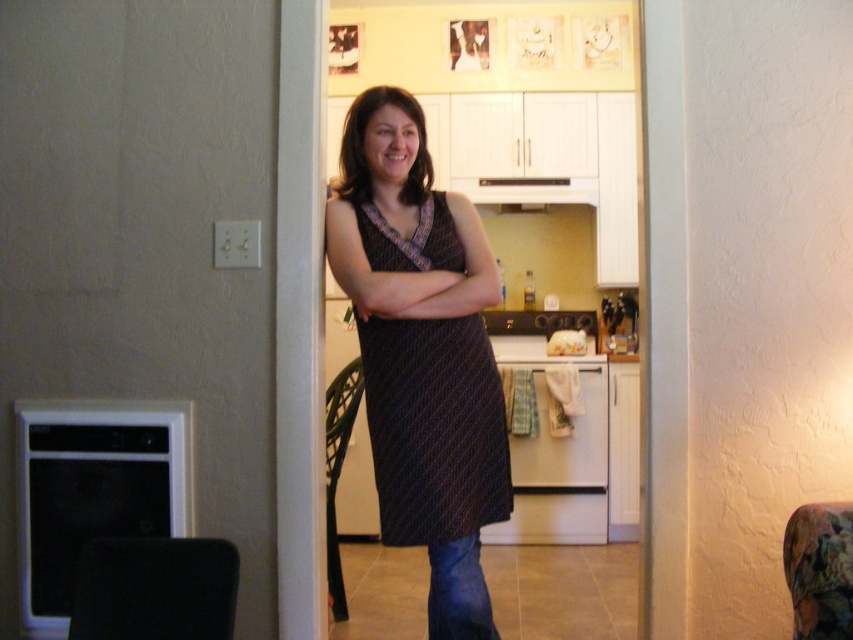
Question: Which object appears farthest from the camera in this image?

Choices:
 (A) matte black dress at center
 (B) dark textured dress at center

Answer: (A)

Question: Which object appears closest to the camera in this image?

Choices:
 (A) dark textured dress at center
 (B) matte black dress at center

Answer: (A)

Question: Does dark textured dress at center lie behind matte black dress at center?

Choices:
 (A) no
 (B) yes

Answer: (A)

Question: Among these points, which one is farthest from the camera?

Choices:
 (A) (389, 304)
 (B) (492, 476)

Answer: (B)

Question: From the image, what is the correct spatial relationship of dark textured dress at center in relation to matte black dress at center?

Choices:
 (A) below
 (B) above

Answer: (A)

Question: Does dark textured dress at center appear over matte black dress at center?

Choices:
 (A) yes
 (B) no

Answer: (B)